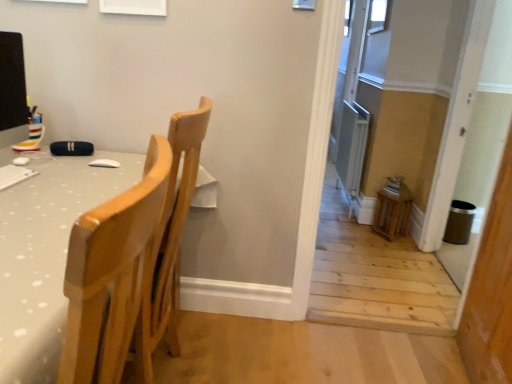
Question: Does matte black monitor at left come in front of light wood chair at left?

Choices:
 (A) yes
 (B) no

Answer: (B)

Question: Is matte black monitor at left thinner than light wood chair at left?

Choices:
 (A) yes
 (B) no

Answer: (A)

Question: From the image's perspective, would you say matte black monitor at left is shown under light wood chair at left?

Choices:
 (A) yes
 (B) no

Answer: (B)

Question: Is matte black monitor at left facing towards light wood chair at left?

Choices:
 (A) yes
 (B) no

Answer: (B)

Question: Does matte black monitor at left have a smaller size compared to light wood chair at left?

Choices:
 (A) no
 (B) yes

Answer: (B)

Question: Considering the positions of transparent glass window at upper center, which appears as the first window when viewed from the back, and clear glass window at upper right, the second window when ordered from top to bottom, in the image, is transparent glass window at upper center, which appears as the first window when viewed from the back, taller or shorter than clear glass window at upper right, the second window when ordered from top to bottom,?

Choices:
 (A) short
 (B) tall

Answer: (B)

Question: Would you say transparent glass window at upper center, which appears as the first window when viewed from the back, is inside or outside clear glass window at upper right, the first window ordered from the bottom?

Choices:
 (A) inside
 (B) outside

Answer: (B)

Question: From a real-world perspective, is transparent glass window at upper center, which appears as the first window when viewed from the back, physically located above or below clear glass window at upper right, placed as the 2th window when sorted from right to left?

Choices:
 (A) below
 (B) above

Answer: (B)

Question: Visually, is transparent glass window at upper center, acting as the first window starting from the top, positioned to the left or to the right of clear glass window at upper right, placed as the 2th window when sorted from right to left?

Choices:
 (A) right
 (B) left

Answer: (A)

Question: Visually, is clear glass window at upper right, the first window ordered from the bottom, positioned to the left or to the right of light wood chair at left?

Choices:
 (A) right
 (B) left

Answer: (A)

Question: From a real-world perspective, is clear glass window at upper right, which ranks as the first window in left-to-right order, positioned above or below light wood chair at left?

Choices:
 (A) below
 (B) above

Answer: (B)

Question: Is point (387, 11) closer or farther from the camera than point (141, 337)?

Choices:
 (A) closer
 (B) farther

Answer: (B)

Question: Considering the positions of clear glass window at upper right, the second window when ordered from top to bottom, and light wood chair at left in the image, is clear glass window at upper right, the second window when ordered from top to bottom, taller or shorter than light wood chair at left?

Choices:
 (A) short
 (B) tall

Answer: (A)

Question: In terms of width, does clear glass window at upper right, the first window ordered from the bottom, look wider or thinner when compared to transparent glass window at upper center, which is the second window from front to back?

Choices:
 (A) thin
 (B) wide

Answer: (A)

Question: From a real-world perspective, is clear glass window at upper right, the 2th window positioned from the back, physically located above or below transparent glass window at upper center, which appears as the first window when viewed from the back?

Choices:
 (A) below
 (B) above

Answer: (A)